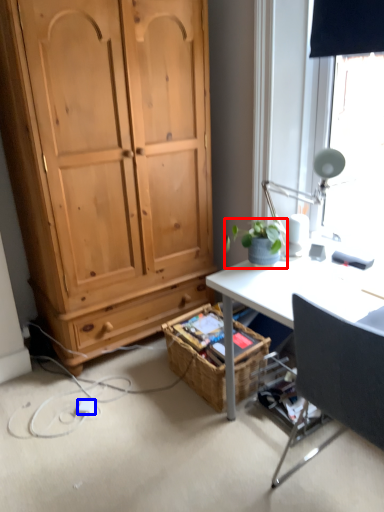
Question: Which of the following is the farthest to the observer, houseplant (highlighted by a red box) or power outlet (highlighted by a blue box)?

Choices:
 (A) houseplant
 (B) power outlet

Answer: (B)